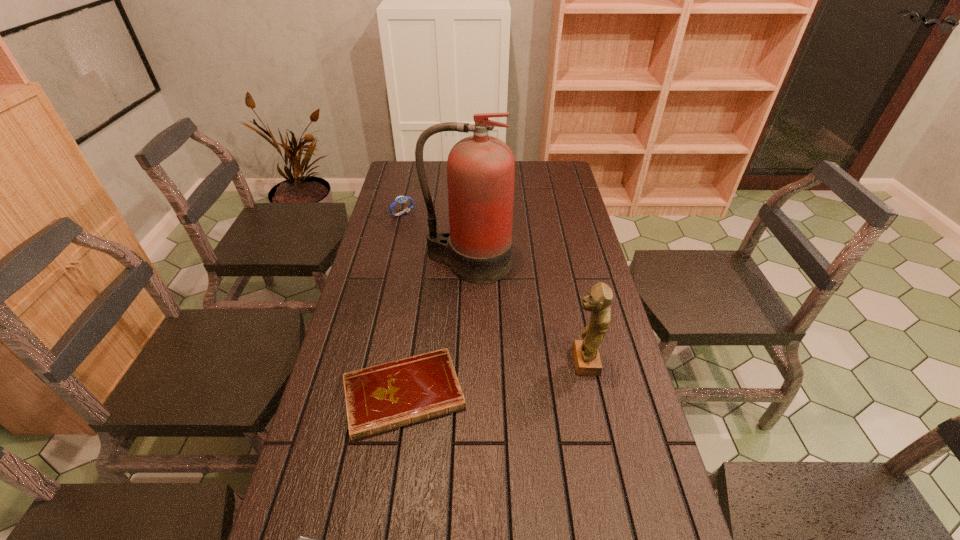
Find the location of `free space located 0.050m on the front-facing side of the fourth shortest object`. free space located 0.050m on the front-facing side of the fourth shortest object is located at coordinates (550, 361).

Identify the location of free region located 0.310m on the right of the third tallest object. 495,213.

At what (x,y) coordinates should I click in order to perform the action: click on vacant space located on the back of the notebook. Please return your answer as a coordinate pair (x, y). Looking at the image, I should click on (415, 324).

Find the location of `watch present at the left edge`. watch present at the left edge is located at coordinates (400, 199).

You are a GUI agent. You are given a task and a screenshot of the screen. Output one action in this format:
    pyautogui.click(x=<x>, y=<y>)
    Task: Click on the notebook present at the left edge
    The height and width of the screenshot is (540, 960).
    Given the screenshot: What is the action you would take?
    pyautogui.click(x=380, y=398)

Find the location of `object positioned at the right edge`. object positioned at the right edge is located at coordinates (587, 361).

Where is `free space at the far edge of the desktop`? This screenshot has height=540, width=960. free space at the far edge of the desktop is located at coordinates (530, 168).

The image size is (960, 540). I want to click on vacant space at the left edge, so tap(370, 291).

This screenshot has width=960, height=540. I want to click on free space at the right edge of the desktop, so click(558, 199).

In the image, there is a desktop. Where is `vacant space at the far left corner`? vacant space at the far left corner is located at coordinates (400, 163).